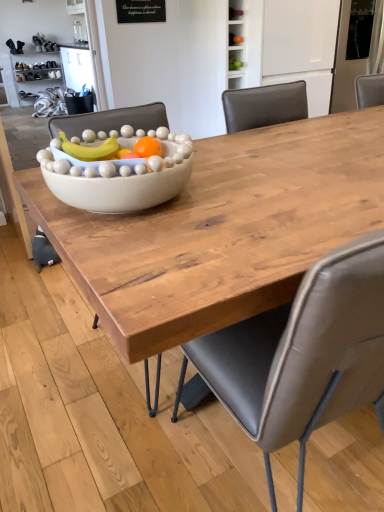
Question: Is gray leather chair at center bigger than white glossy bowl at center?

Choices:
 (A) no
 (B) yes

Answer: (B)

Question: Is gray leather chair at center located outside white glossy bowl at center?

Choices:
 (A) yes
 (B) no

Answer: (A)

Question: From the image's perspective, would you say gray leather chair at center is shown under white glossy bowl at center?

Choices:
 (A) no
 (B) yes

Answer: (B)

Question: Are gray leather chair at center and white glossy bowl at center located far from each other?

Choices:
 (A) yes
 (B) no

Answer: (B)

Question: Is gray leather chair at center positioned in front of white glossy bowl at center?

Choices:
 (A) no
 (B) yes

Answer: (B)

Question: Considering the relative sizes of gray leather chair at center and white glossy bowl at center in the image provided, is gray leather chair at center taller than white glossy bowl at center?

Choices:
 (A) yes
 (B) no

Answer: (A)

Question: Does matte wood bowl at center have a smaller size compared to white glossy bowl at center?

Choices:
 (A) no
 (B) yes

Answer: (A)

Question: Considering the relative sizes of matte wood bowl at center and white glossy bowl at center in the image provided, is matte wood bowl at center wider than white glossy bowl at center?

Choices:
 (A) no
 (B) yes

Answer: (B)

Question: Considering the relative sizes of matte wood bowl at center and white glossy bowl at center in the image provided, is matte wood bowl at center taller than white glossy bowl at center?

Choices:
 (A) no
 (B) yes

Answer: (B)

Question: Is matte wood bowl at center positioned in front of white glossy bowl at center?

Choices:
 (A) no
 (B) yes

Answer: (B)

Question: From the image's perspective, is matte wood bowl at center above white glossy bowl at center?

Choices:
 (A) yes
 (B) no

Answer: (B)

Question: From a real-world perspective, is matte wood bowl at center on top of white glossy bowl at center?

Choices:
 (A) yes
 (B) no

Answer: (B)

Question: From the image's perspective, is white glossy bowl at center on top of matte wood bowl at center?

Choices:
 (A) no
 (B) yes

Answer: (B)